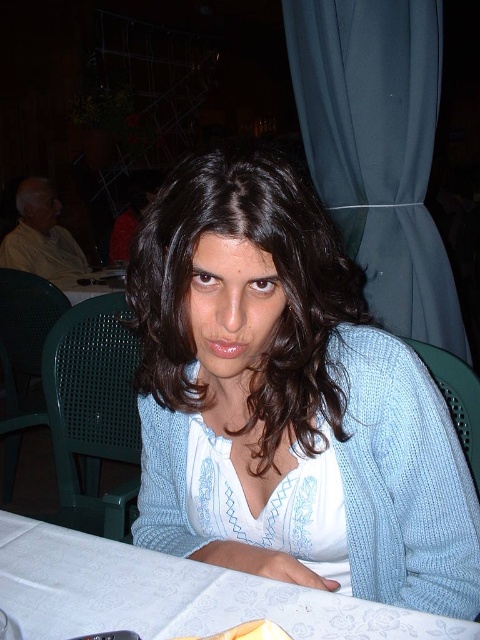
You are a photographer trying to capture a closeup of the light blue knit sweater at center and the white fabric table at lower center. Since you want both objects in focus, which one should you adjust the camera focus to prioritize based on their sizes?

The light blue knit sweater at center is bigger than the white fabric table at lower center, so you should prioritize focusing on the light blue knit sweater at center because larger objects often require more precise focus to ensure clarity.

You are a delivery person who needs to place a small package on the table without disturbing the woman. The package is 3 inches long. Can you fit it between the light blue knit sweater at center and the white fabric table at lower center?

The distance between the light blue knit sweater at center and the white fabric table at lower center is 8.09 inches. Since the package is only 3 inches long, it can easily fit in the space between them.

You are a photographer adjusting your camera settings. You notice the light blue knit sweater at center in the scene. Based on its position, can you determine if it will be in focus if you set the focus point to the center of the image?

The light blue knit sweater at center is located at point (288,403), which is close to the center of the image. Therefore, setting the focus point to the center should keep the light blue knit sweater at center in focus.